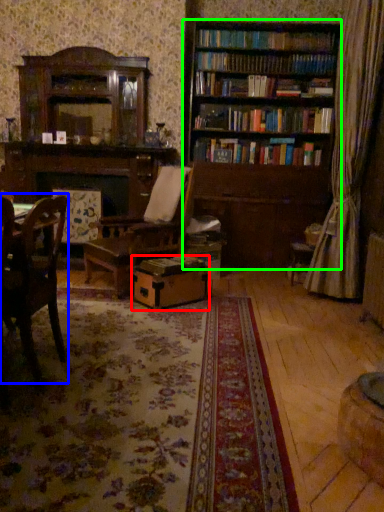
Question: Based on their relative distances, which object is nearer to cardboard box (highlighted by a red box)? Choose from chair (highlighted by a blue box) and bookcase (highlighted by a green box).

Choices:
 (A) chair
 (B) bookcase

Answer: (A)